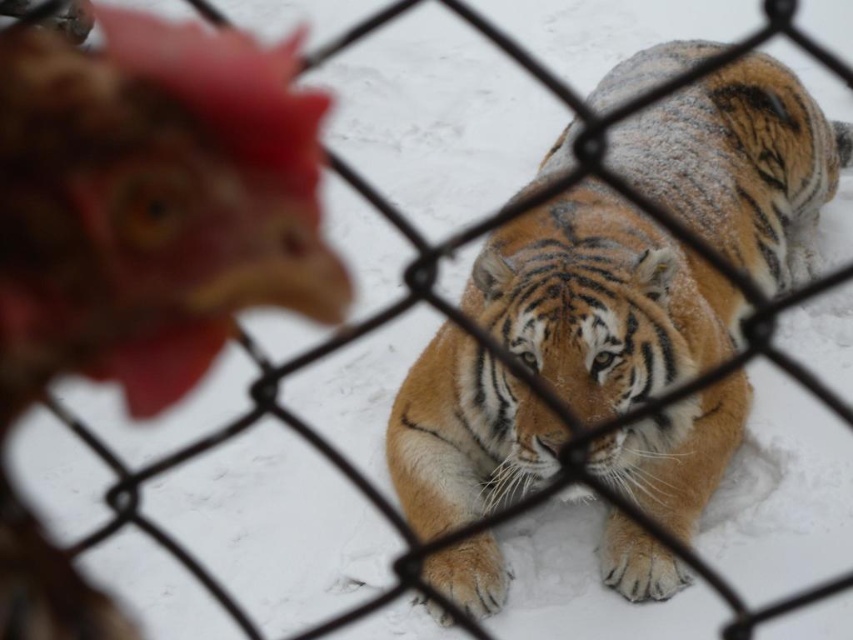
Can you confirm if orange fur tiger at center is positioned above brown feathered chicken at left?

Incorrect, orange fur tiger at center is not positioned above brown feathered chicken at left.

Can you confirm if orange fur tiger at center is positioned to the left of brown feathered chicken at left?

No, orange fur tiger at center is not to the left of brown feathered chicken at left.

Does point (686, 52) lie behind point (241, 228)?

No, it is not.

Locate an element on the screen. The image size is (853, 640). orange fur tiger at center is located at coordinates (601, 301).